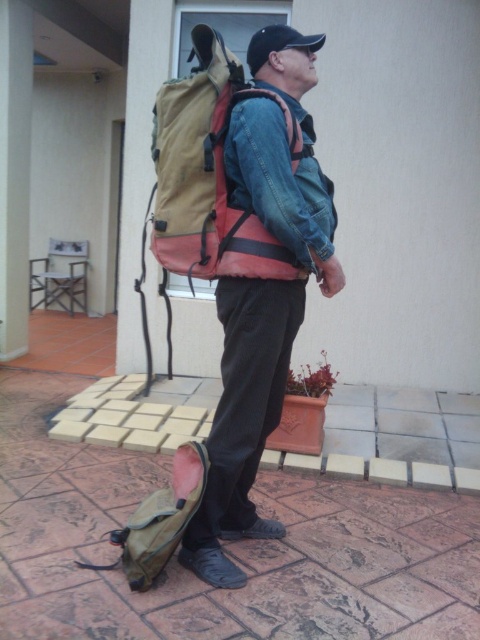
Is the position of matte khaki backpack at center less distant than that of black leather shoe at lower center?

Yes.

Who is higher up, matte khaki backpack at center or black leather shoe at lower center?

matte khaki backpack at center is above.

This screenshot has width=480, height=640. What do you see at coordinates (265, 268) in the screenshot?
I see `matte khaki backpack at center` at bounding box center [265, 268].

Image resolution: width=480 pixels, height=640 pixels. In order to click on matte khaki backpack at center in this screenshot , I will do (265, 268).

Does denim jacket at center come behind matte khaki backpack at lower left?

No, denim jacket at center is closer to the viewer.

Based on the photo, who is shorter, denim jacket at center or matte khaki backpack at lower left?

matte khaki backpack at lower left

Which is behind, point (325, 198) or point (171, 531)?

The point (325, 198) is more distant.

I want to click on denim jacket at center, so click(278, 177).

Does point (179, 484) come behind point (224, 531)?

No, it is not.

You are a GUI agent. You are given a task and a screenshot of the screen. Output one action in this format:
    pyautogui.click(x=<x>, y=<y>)
    Task: Click on the matte khaki backpack at lower left
    
    Given the screenshot: What is the action you would take?
    pyautogui.click(x=163, y=516)

Does point (166, 506) come closer to viewer compared to point (262, 536)?

That is True.

Find the location of a particular element. This screenshot has height=640, width=480. matte khaki backpack at lower left is located at coordinates (163, 516).